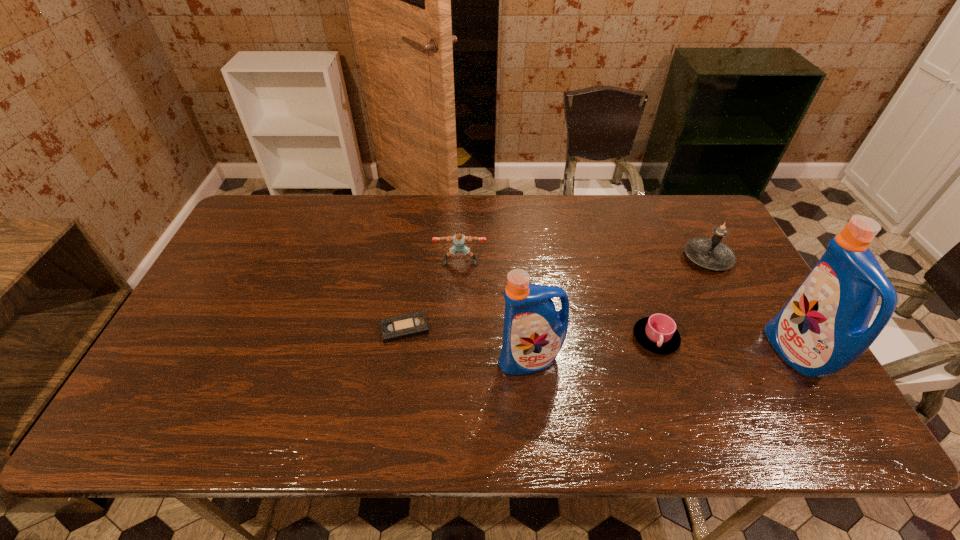
Locate an element on the screen. This screenshot has width=960, height=540. vacant space located 0.090m on the label of the taller detergent is located at coordinates (738, 354).

Where is `free space located on the label of the taller detergent`? Image resolution: width=960 pixels, height=540 pixels. free space located on the label of the taller detergent is located at coordinates (699, 354).

Where is `vacant area situated on the back of the candle`? vacant area situated on the back of the candle is located at coordinates (685, 215).

At what (x,y) coordinates should I click in order to perform the action: click on vacant position located 0.060m on the front-facing side of the puncher. Please return your answer as a coordinate pair (x, y). This screenshot has width=960, height=540. Looking at the image, I should click on (460, 281).

Where is `vacant space located 0.130m on the left of the shortest object`? The image size is (960, 540). vacant space located 0.130m on the left of the shortest object is located at coordinates (331, 329).

Locate an element on the screen. The width and height of the screenshot is (960, 540). vacant region located on the side with the handle of the cup is located at coordinates (674, 393).

You are a GUI agent. You are given a task and a screenshot of the screen. Output one action in this format:
    pyautogui.click(x=<x>, y=<y>)
    Task: Click on the detergent positioned at the right edge
    The image size is (960, 540).
    Given the screenshot: What is the action you would take?
    pyautogui.click(x=823, y=328)

Locate an element on the screen. The image size is (960, 540). candle located at the right edge is located at coordinates (711, 253).

Where is `object that is at the near right corner`? object that is at the near right corner is located at coordinates (823, 328).

I want to click on free spot at the far edge of the desktop, so click(398, 205).